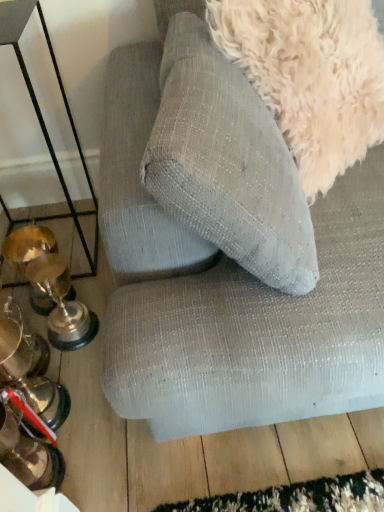
Question: Would you consider metallic trophies at left to be distant from fuzzy white dog at upper right?

Choices:
 (A) yes
 (B) no

Answer: (B)

Question: From a real-world perspective, is metallic trophies at left positioned over fuzzy white dog at upper right based on gravity?

Choices:
 (A) yes
 (B) no

Answer: (B)

Question: Does metallic trophies at left appear on the right side of fuzzy white dog at upper right?

Choices:
 (A) no
 (B) yes

Answer: (A)

Question: From a real-world perspective, is metallic trophies at left under fuzzy white dog at upper right?

Choices:
 (A) no
 (B) yes

Answer: (B)

Question: Is metallic trophies at left to the left of fuzzy white dog at upper right from the viewer's perspective?

Choices:
 (A) no
 (B) yes

Answer: (B)

Question: Considering the relative sizes of metallic trophies at left and fuzzy white dog at upper right in the image provided, is metallic trophies at left taller than fuzzy white dog at upper right?

Choices:
 (A) yes
 (B) no

Answer: (A)

Question: Are fuzzy white dog at upper right and textured fabric couch at upper center making contact?

Choices:
 (A) no
 (B) yes

Answer: (A)

Question: Is fuzzy white dog at upper right to the left of textured fabric couch at upper center from the viewer's perspective?

Choices:
 (A) yes
 (B) no

Answer: (A)

Question: Considering the relative sizes of fuzzy white dog at upper right and textured fabric couch at upper center in the image provided, is fuzzy white dog at upper right bigger than textured fabric couch at upper center?

Choices:
 (A) yes
 (B) no

Answer: (B)

Question: Would you say fuzzy white dog at upper right is a long distance from textured fabric couch at upper center?

Choices:
 (A) yes
 (B) no

Answer: (B)

Question: Is fuzzy white dog at upper right taller than textured fabric couch at upper center?

Choices:
 (A) no
 (B) yes

Answer: (A)

Question: Is fuzzy white dog at upper right looking in the opposite direction of textured fabric couch at upper center?

Choices:
 (A) yes
 (B) no

Answer: (A)

Question: Can you confirm if metallic trophies at left is wider than textured fabric couch at upper center?

Choices:
 (A) no
 (B) yes

Answer: (A)